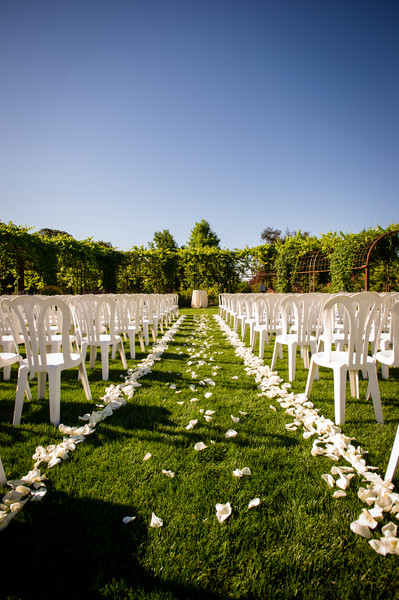
In order to click on section of chairs on the right side in this screenshot , I will do `click(322, 353)`.